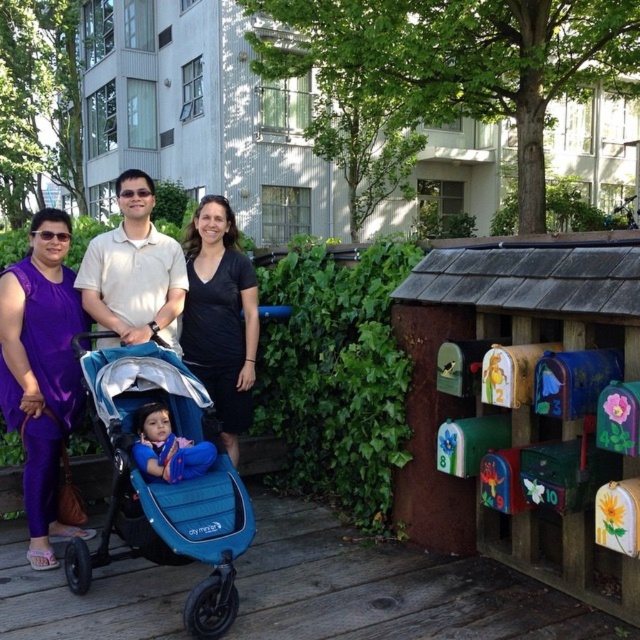
You are a parent trying to decide whether to place a small toy on the matte blue stroller at center or the matte white polo shirt at center. Based on their sizes, which object would be more suitable for placing the toy?

The matte blue stroller at center is larger in size than the matte white polo shirt at center, so the toy would be more suitable to place on the matte blue stroller at center.

You are a photographer positioned at the end of the wooden deck. You want to take a photo of the purple fabric dress at left and the matte blue stroller at center. Which object should you focus on first to ensure both are in sharp focus?

The purple fabric dress at left is closer to the viewer than the matte blue stroller at center. To ensure both are in sharp focus, you should focus on the purple fabric dress at left first, as it is closer, and the depth of field may extend to include the matte blue stroller at center.

You are a photographer trying to capture a photo of the purple fabric dress at left and the matte blue stroller at center. Since you want both subjects to be in focus, you need to know their distance apart. Can you determine if they are close enough for a single shot?

The purple fabric dress at left is positioned on the left side of matte blue stroller at center, but the exact distance between them is not provided. Without knowing the distance, it is uncertain if they can be captured in a single focused shot.